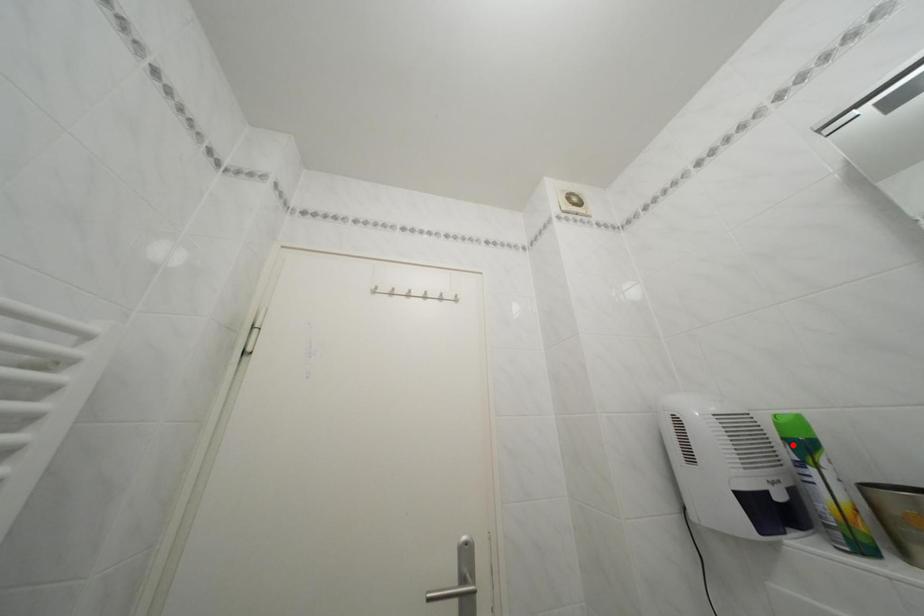
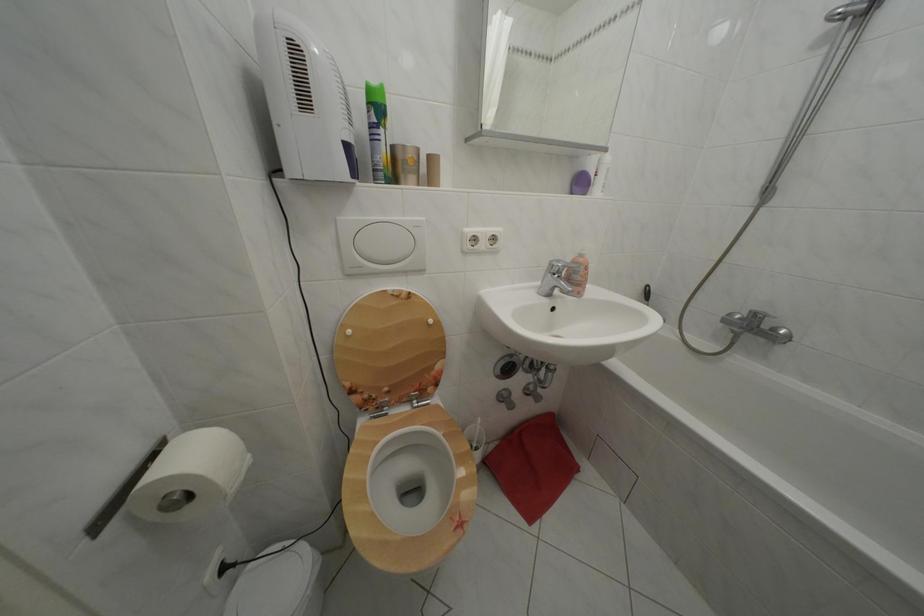
Question: I am providing you with two images of the same scene from different viewpoints. A red point is marked on the first image. Can you still see the location of the red point in image 2?

Choices:
 (A) Yes
 (B) No

Answer: (A)